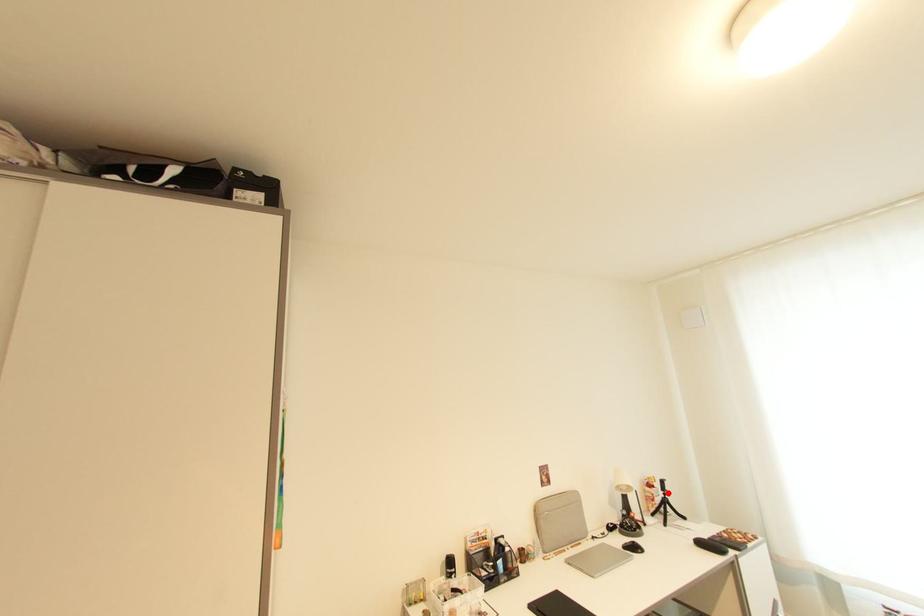
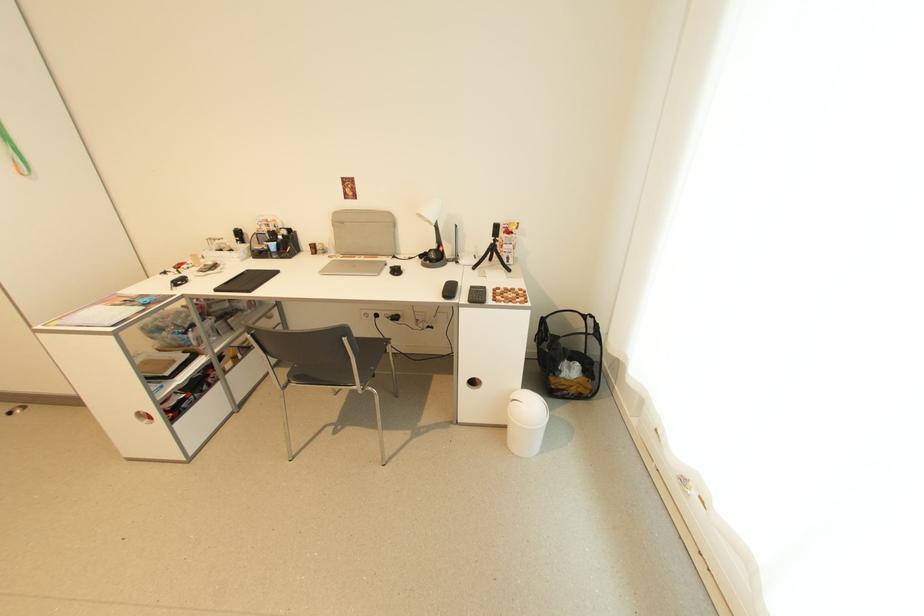
Where in the second image is the point corresponding to the highlighted location from the first image?

(497, 238)